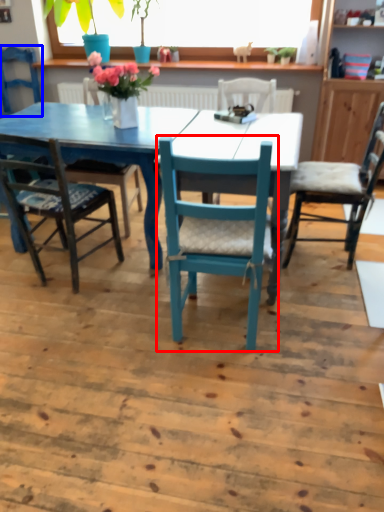
Question: Which object appears closest to the camera in this image, chair (highlighted by a red box) or chair (highlighted by a blue box)?

Choices:
 (A) chair
 (B) chair

Answer: (A)